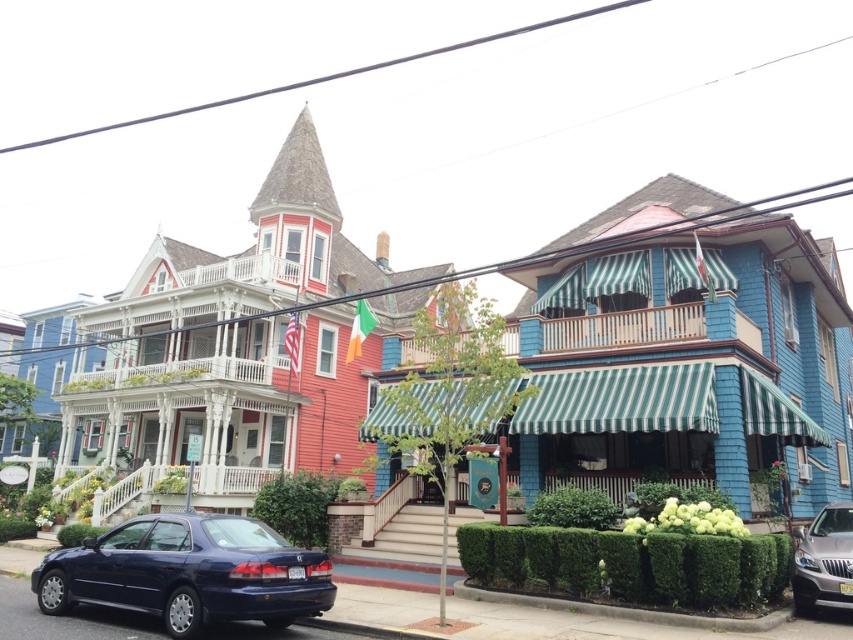
Is point (523, 554) closer to camera compared to point (381, 582)?

Yes, point (523, 554) is in front of point (381, 582).

Which is behind, point (607, 547) or point (431, 582)?

The point (431, 582) is more distant.

Does point (743, 563) come closer to viewer compared to point (364, 582)?

Yes, point (743, 563) is in front of point (364, 582).

Where is `green leafy hedge at lower center`? green leafy hedge at lower center is located at coordinates (628, 564).

Between silver metallic suv at lower right and green leafy hedge at center, which one appears on the left side from the viewer's perspective?

green leafy hedge at center is more to the left.

Is silver metallic suv at lower right closer to the viewer compared to green leafy hedge at center?

Yes.

Who is more distant from viewer, (848, 541) or (310, 536)?

The point (310, 536) is behind.

This screenshot has height=640, width=853. Identify the location of silver metallic suv at lower right. (822, 561).

Can you confirm if silver metallic suv at lower right is taller than red concrete curb at lower center?

Indeed, silver metallic suv at lower right has a greater height compared to red concrete curb at lower center.

Can you confirm if silver metallic suv at lower right is positioned below red concrete curb at lower center?

Incorrect, silver metallic suv at lower right is not positioned below red concrete curb at lower center.

Image resolution: width=853 pixels, height=640 pixels. I want to click on silver metallic suv at lower right, so click(822, 561).